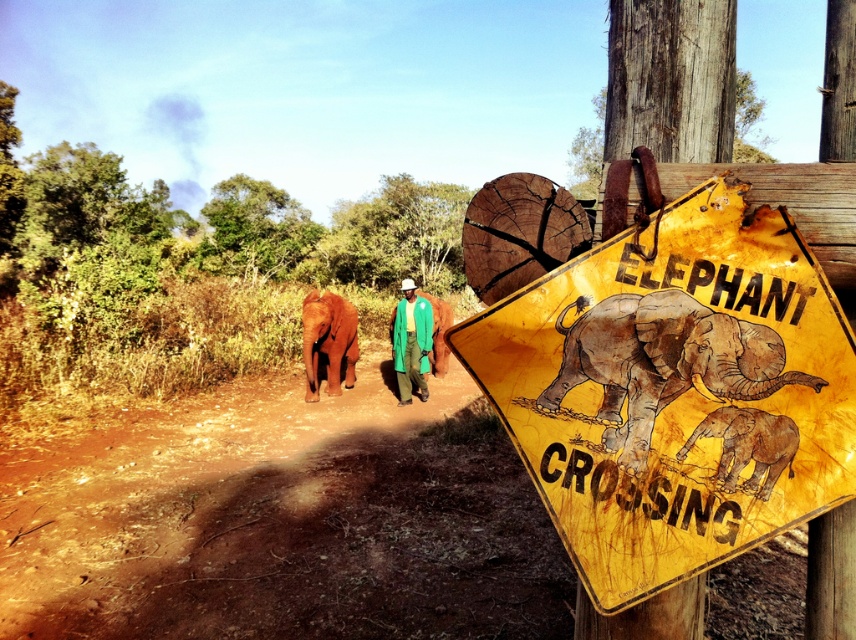
Looking at this image, you are a park ranger who needs to place a new sign exactly halfway between the rusty metal elephant at center and the orange smooth elephant at lower left. Which elephant will the new sign be closer to?

The new sign will be closer to the rusty metal elephant at center because it has a lesser height compared to the orange smooth elephant at lower left, so the distance between them would be measured from their base positions, making the halfway point nearer to the shorter one.

You are a wildlife photographer observing the scene from a safe distance. You notice the brown textured baby elephant at lower right and the green fabric jacket at center. Which object is narrower in width?

The brown textured baby elephant at lower right is thinner than the green fabric jacket at center, so the baby elephant is narrower in width.

You are a park ranger who needs to identify the elephants in the image. Which elephant has a thinner body? The options are the rusty metal elephant at center and the orange smooth elephant at lower left.

The rusty metal elephant at center is thinner than the orange smooth elephant at lower left.